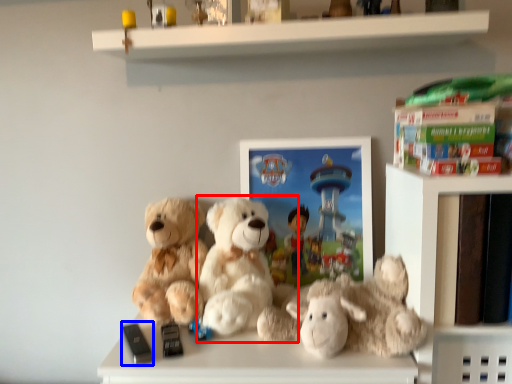
Question: Among these objects, which one is farthest to the camera, teddy bear (highlighted by a red box) or toy (highlighted by a blue box)?

Choices:
 (A) teddy bear
 (B) toy

Answer: (A)